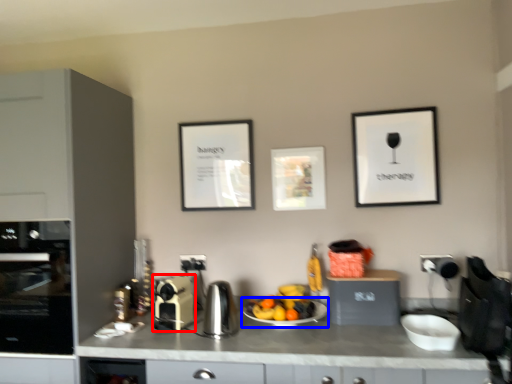
Question: Which object is further to the camera taking this photo, kitchen appliance (highlighted by a red box) or plate (highlighted by a blue box)?

Choices:
 (A) kitchen appliance
 (B) plate

Answer: (A)